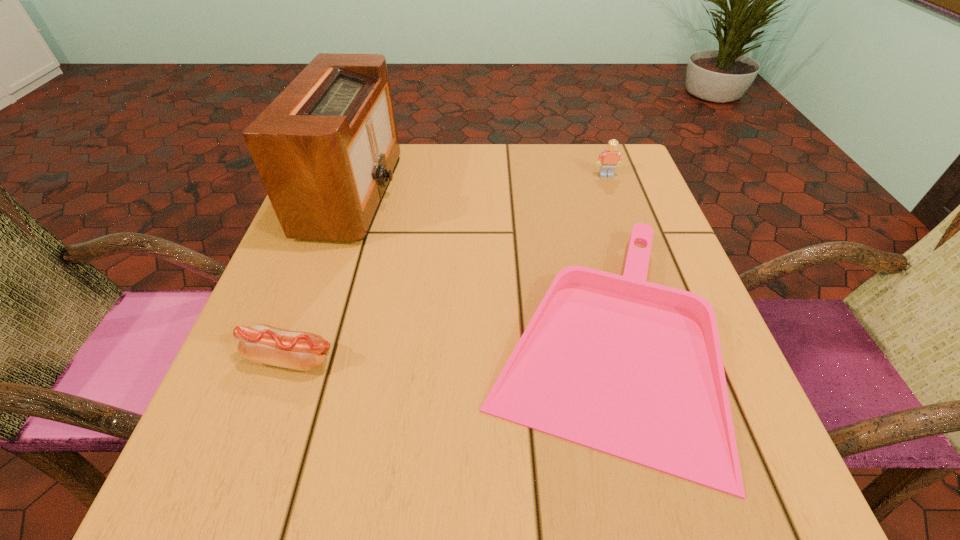
Identify the location of free location at the far edge of the desktop. (557, 195).

Locate an element on the screen. The width and height of the screenshot is (960, 540). vacant position at the near edge of the desktop is located at coordinates (396, 503).

Find the location of a particular element. vacant space at the left edge is located at coordinates 291,289.

Identify the location of free space at the right edge of the desktop. The image size is (960, 540). (625, 212).

The image size is (960, 540). In the image, there is a desktop. Find the location of `vacant space at the near left corner`. vacant space at the near left corner is located at coordinates (286, 471).

In the image, there is a desktop. Where is `vacant space at the far right corner`? vacant space at the far right corner is located at coordinates (621, 145).

Where is `empty space between the radio receiver and the Lego`? This screenshot has height=540, width=960. empty space between the radio receiver and the Lego is located at coordinates (479, 184).

Identify the location of vacant space that is in between the shortest object and the tallest object. This screenshot has width=960, height=540. tap(473, 266).

The height and width of the screenshot is (540, 960). In order to click on unoccupied position between the tallest object and the third tallest object in this screenshot , I will do `click(322, 275)`.

Where is `free spot between the shortest object and the radio receiver`? free spot between the shortest object and the radio receiver is located at coordinates (473, 266).